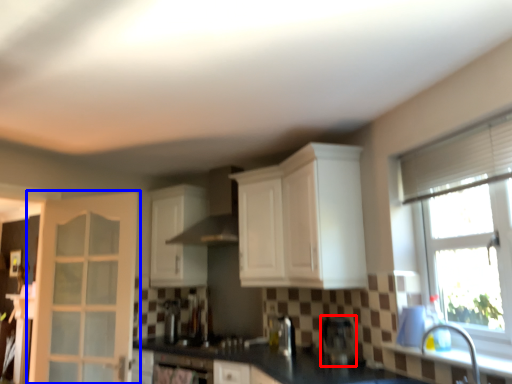
Question: Which of the following is the farthest to the observer, coffee machine (highlighted by a red box) or door (highlighted by a blue box)?

Choices:
 (A) coffee machine
 (B) door

Answer: (B)